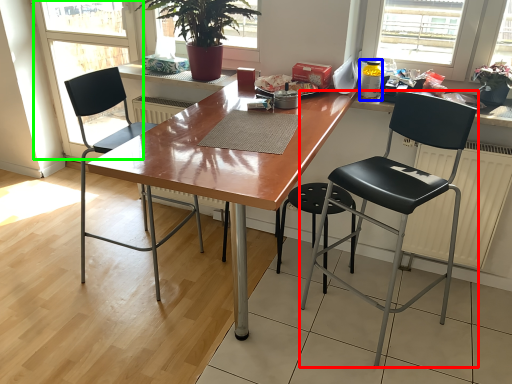
Question: Estimate the real-world distances between objects in this image. Which object is farther from chair (highlighted by a red box), bottle (highlighted by a blue box) or screen door (highlighted by a green box)?

Choices:
 (A) bottle
 (B) screen door

Answer: (B)